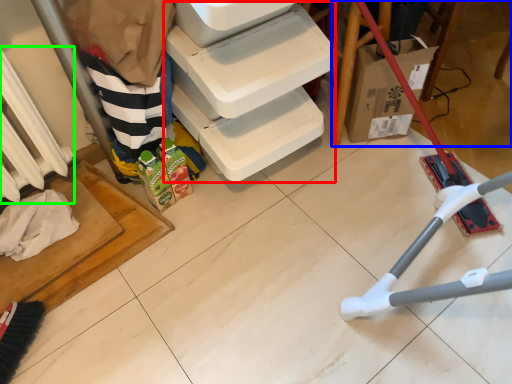
Question: Considering the real-world distances, which object is closest to shelf (highlighted by a red box)? furniture (highlighted by a blue box) or radiator (highlighted by a green box).

Choices:
 (A) furniture
 (B) radiator

Answer: (A)